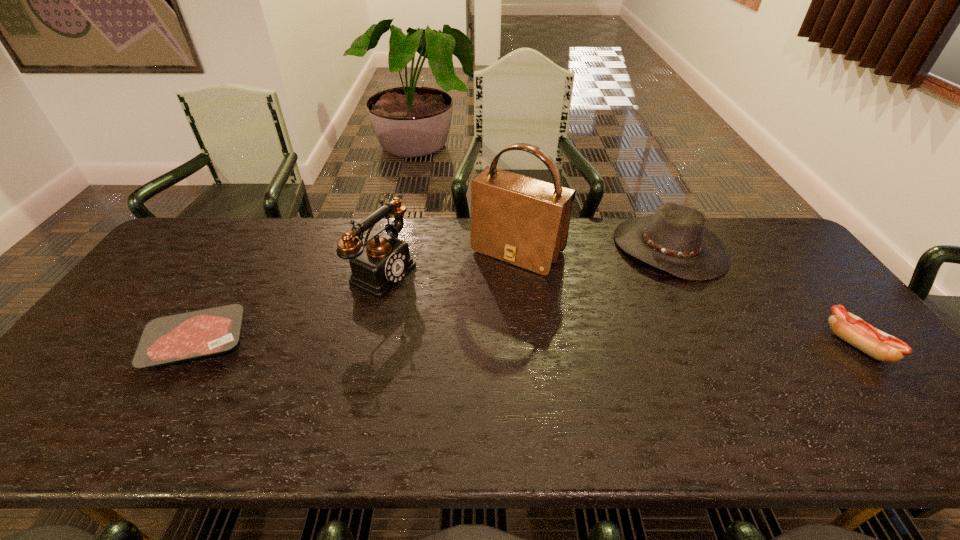
The width and height of the screenshot is (960, 540). Identify the location of vacant area at the left edge of the desktop. (131, 358).

In the image, there is a desktop. At what (x,y) coordinates should I click in order to perform the action: click on vacant space at the right edge. Please return your answer as a coordinate pair (x, y). The width and height of the screenshot is (960, 540). Looking at the image, I should click on (840, 361).

The width and height of the screenshot is (960, 540). What are the coordinates of `vacant space at the far right corner of the desktop` in the screenshot? It's located at coord(756,219).

Locate an element on the screen. vacant space at the near right corner of the desktop is located at coordinates (866, 379).

At what (x,y) coordinates should I click in order to perform the action: click on vacant space that is in between the rightmost object and the hat. Please return your answer as a coordinate pair (x, y). The height and width of the screenshot is (540, 960). Looking at the image, I should click on (763, 296).

Locate an element on the screen. The image size is (960, 540). vacant space that is in between the rightmost object and the fourth object from right to left is located at coordinates (621, 308).

You are a GUI agent. You are given a task and a screenshot of the screen. Output one action in this format:
    pyautogui.click(x=<x>, y=<y>)
    Task: Click on the free space between the third object from right to left and the second tallest object
    
    Given the screenshot: What is the action you would take?
    pyautogui.click(x=451, y=261)

Find the location of a particular element. Image resolution: width=960 pixels, height=540 pixels. free space that is in between the shoulder bag and the second tallest object is located at coordinates coord(451,261).

In order to click on free space that is in between the shoulder bag and the shortest object in this screenshot , I will do `click(357, 297)`.

Where is `unoccupied area between the sausage and the fourth shortest object`? Image resolution: width=960 pixels, height=540 pixels. unoccupied area between the sausage and the fourth shortest object is located at coordinates (621, 308).